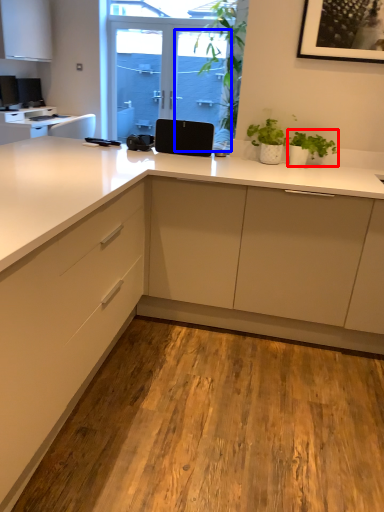
Question: Which object is further to the camera taking this photo, houseplant (highlighted by a red box) or screen door (highlighted by a blue box)?

Choices:
 (A) houseplant
 (B) screen door

Answer: (B)